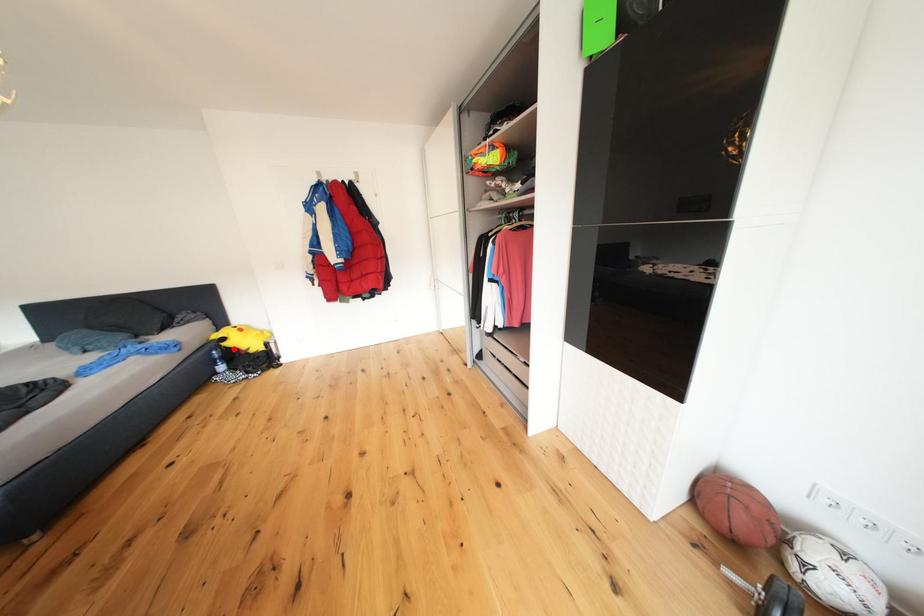
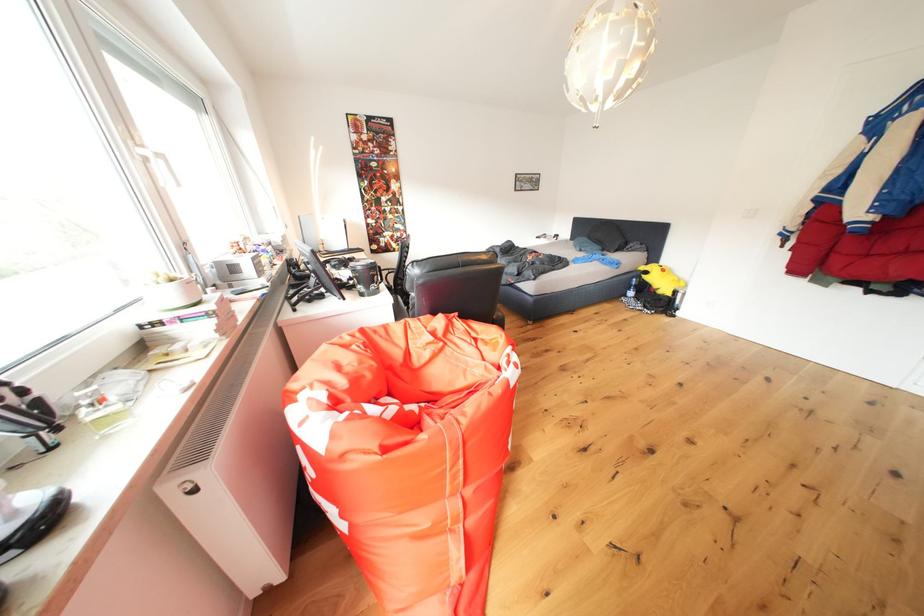
Locate, in the second image, the point that corresponds to the highlighted location in the first image.

(653, 282)